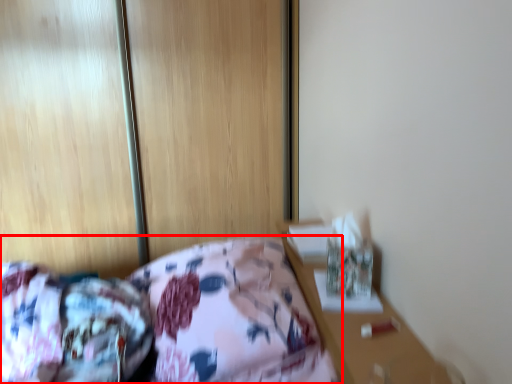
Question: Observing the image, what is the correct spatial positioning of bed (annotated by the red box) in reference to mattress?

Choices:
 (A) left
 (B) right

Answer: (B)